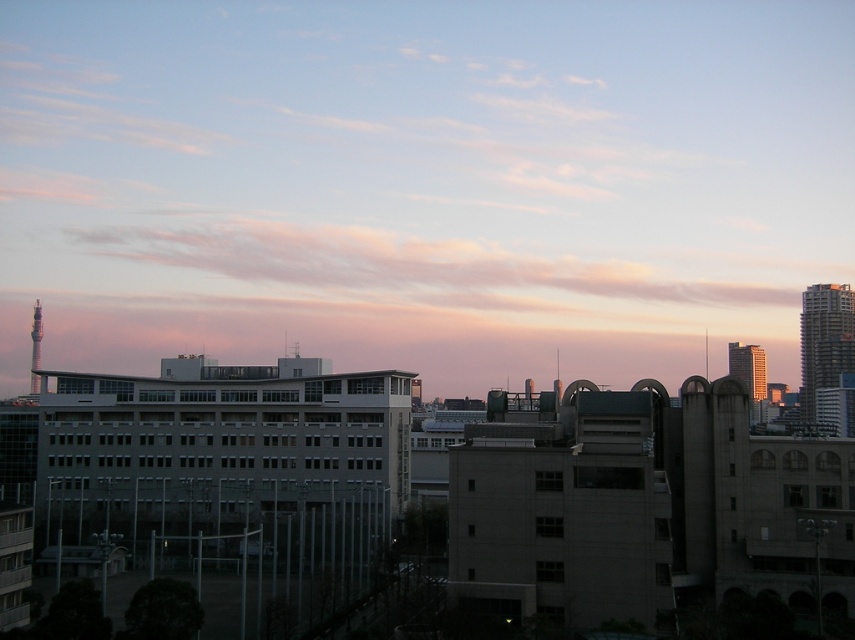
You are a drone operator tasked with flying a drone between the matte gray building at center and the silver metallic skyscraper at right. The drone has a maximum flight distance of 100 meters. Can you safely fly the drone from one to the other without exceeding its range?

The matte gray building at center and silver metallic skyscraper at right are 120.65 meters apart from each other, which exceeds the drone operator maximum flight distance of 100 meters. Therefore, the drone cannot safely fly between them without exceeding its range.

You are a city planner analyzing the layout of the city. You need to determine the spatial relationship between the matte gray building at center and the silver metallic skyscraper at right. Which one is located to the left of the other?

The matte gray building at center is positioned on the left side of silver metallic skyscraper at right, so the matte gray building at center is to the left of the silver metallic skyscraper at right.